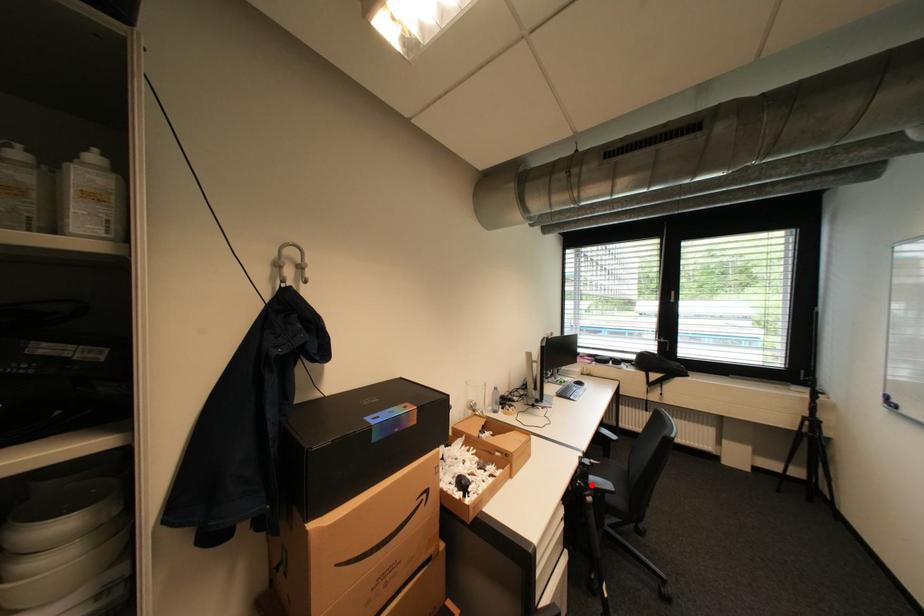
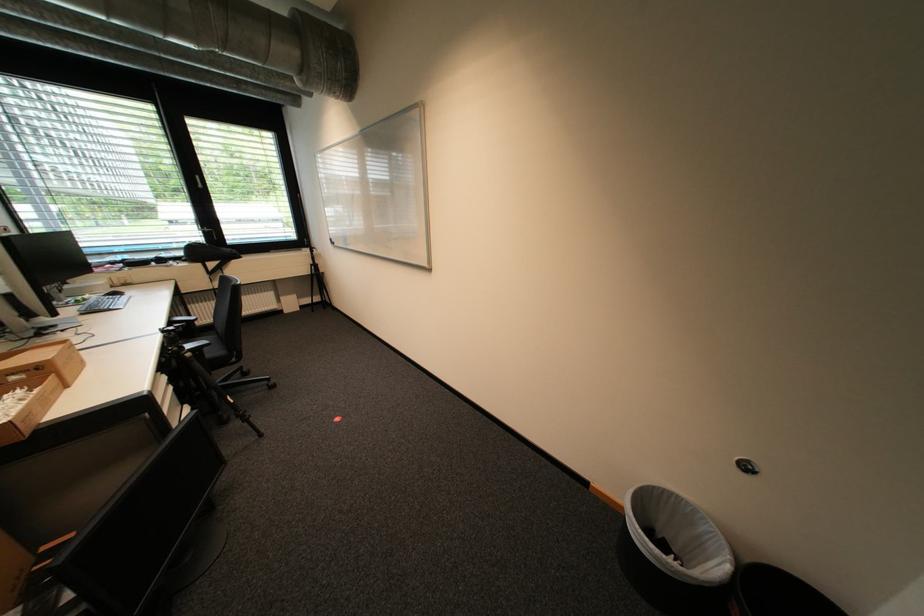
Question: I am providing you with two images of the same scene from different viewpoints. Given a red point in image1, look at the same physical point in image2. Is it:

Choices:
 (A) Closer to the viewpoint
 (B) Farther from the viewpoint

Answer: (A)